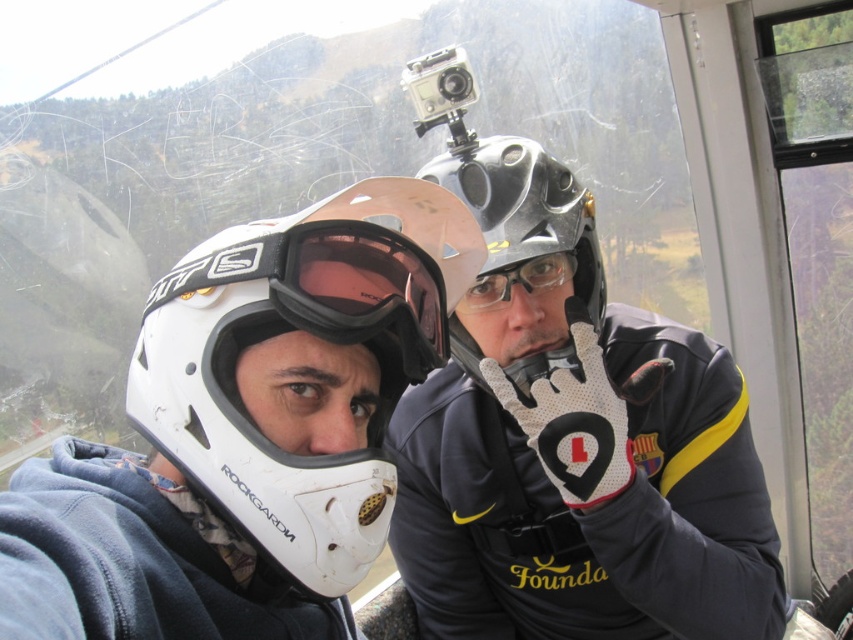
Question: Can you confirm if metallic silver helmet at upper right is bigger than transparent plastic goggles at center?

Choices:
 (A) yes
 (B) no

Answer: (A)

Question: Does metallic silver helmet at upper right appear on the left side of transparent plastic goggles at center?

Choices:
 (A) yes
 (B) no

Answer: (B)

Question: Which object appears closest to the camera in this image?

Choices:
 (A) transparent plastic goggles at center
 (B) white matte helmet at center

Answer: (B)

Question: Can you confirm if metallic gray helmet at center is wider than transparent plastic goggles at center?

Choices:
 (A) no
 (B) yes

Answer: (B)

Question: Which of the following is the closest to the observer?

Choices:
 (A) (611, 536)
 (B) (361, 500)
 (C) (527, 273)
 (D) (531, 177)

Answer: (B)

Question: Which of the following is the closest to the observer?

Choices:
 (A) (480, 208)
 (B) (274, 257)

Answer: (B)